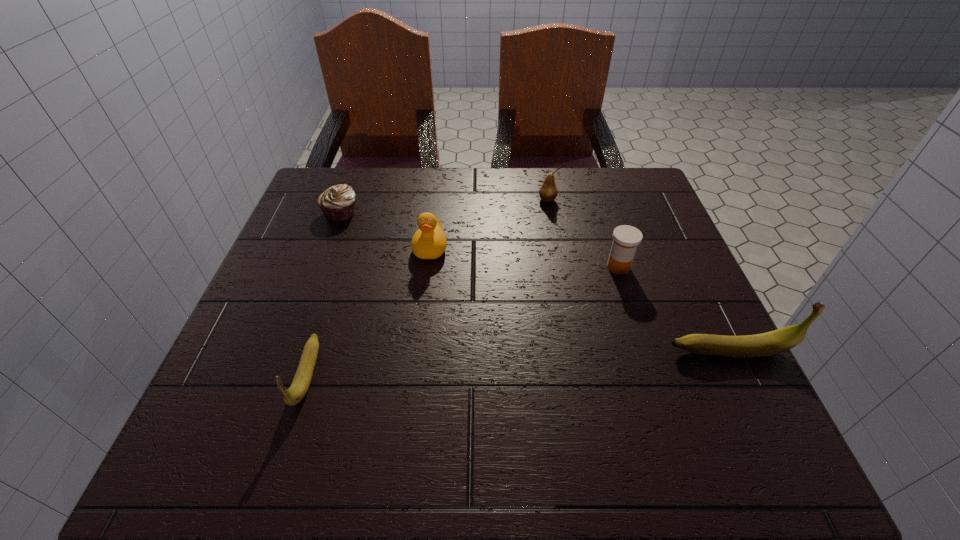
If equal spacing is desired by inserting an extra banana among them, please point out a free spot for this new banana. Please provide its 2D coordinates. Your answer should be formatted as a tuple, i.e. [(x, y)], where the tuple contains the x and y coordinates of a point satisfying the conditions above.

[(522, 362)]